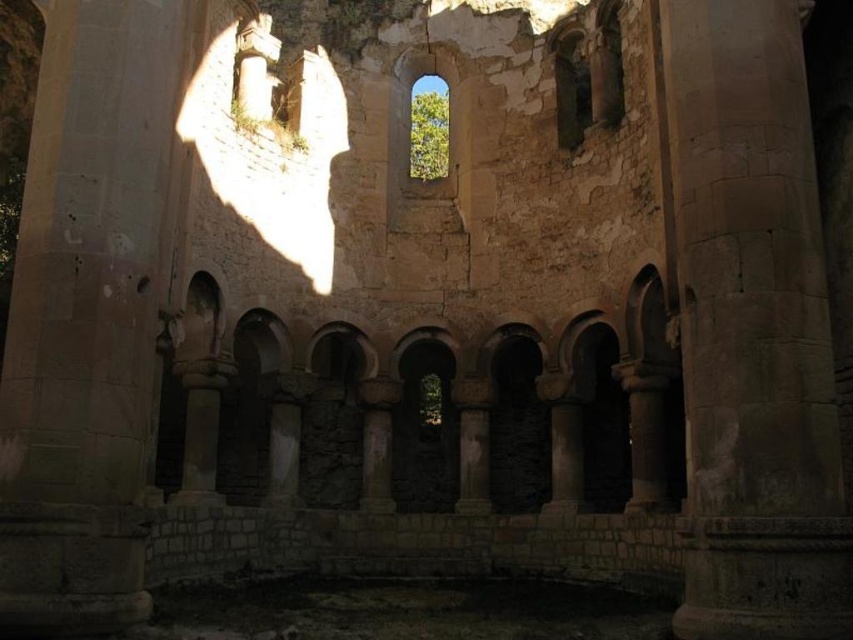
You are an architect planning to install a new statue that requires a base 2 meters tall. You see the gray stone column at center and the clear glass window at upper center. Which object can accommodate the statue base in terms of height?

The gray stone column at center is much taller than the clear glass window at upper center, so the statue base can be placed near the gray stone column at center as it provides sufficient height.

You are an archaeologist examining the ancient stone structure. You notice the gray stone column at center and the clear glass window at upper center. Which object is located higher up in the structure?

The clear glass window at upper center is located higher up in the structure than the gray stone column at center.

You are an architect examining the ancient stone structure. You need to determine which object, the gray stone column at center or the clear glass window at upper center, occupies more space in the image. Based on the scene description, which one is bigger?

The gray stone column at center has a larger size compared to the clear glass window at upper center, so the gray stone column at center occupies more space in the image.